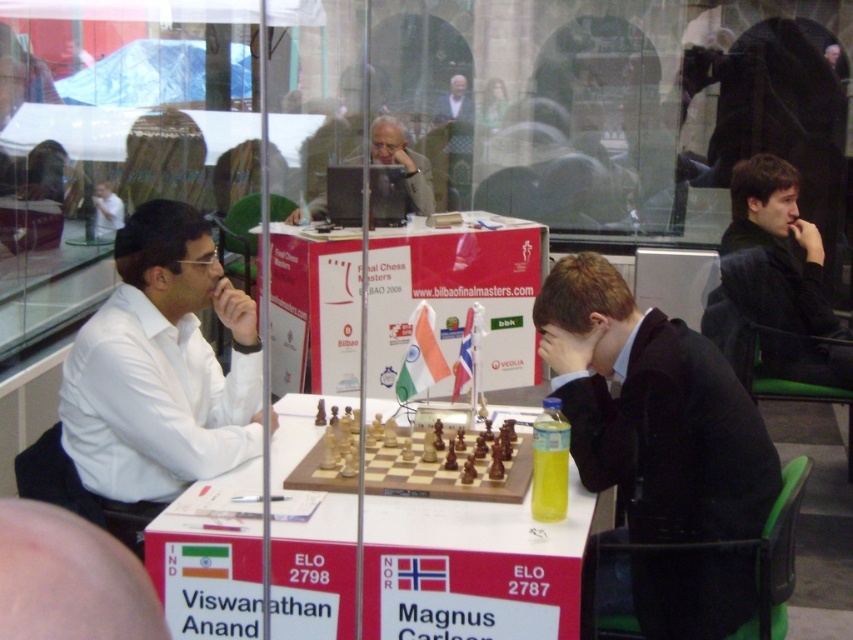
Question: Which object is closer to the camera taking this photo?

Choices:
 (A) black suit at center
 (B) white shirt at left
 (C) wooden chessboard at center
 (D) black fabric jacket at upper right

Answer: (A)

Question: Which of the following is the closest to the observer?

Choices:
 (A) (189, 433)
 (B) (378, 128)

Answer: (A)

Question: Which point appears closest to the camera in this image?

Choices:
 (A) (804, 346)
 (B) (556, 525)
 (C) (457, 465)
 (D) (699, 376)

Answer: (B)

Question: Is white shirt at left further to the viewer compared to wooden chessboard at center?

Choices:
 (A) no
 (B) yes

Answer: (B)

Question: From the image, what is the correct spatial relationship of white shirt at left in relation to wooden chessboard at center?

Choices:
 (A) right
 (B) left

Answer: (B)

Question: Is white shirt at left thinner than matte black laptop at upper center?

Choices:
 (A) no
 (B) yes

Answer: (A)